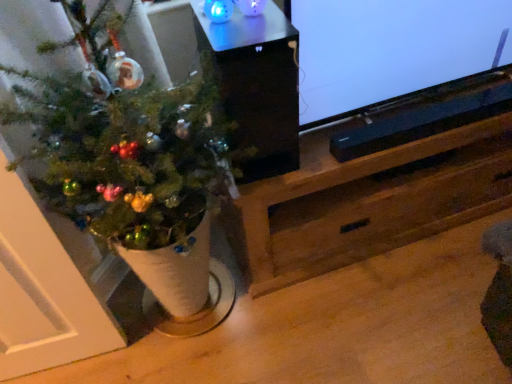
The width and height of the screenshot is (512, 384). Find the location of `vacant area that is situated to the right of green matte christmas tree at left`. vacant area that is situated to the right of green matte christmas tree at left is located at coordinates (320, 321).